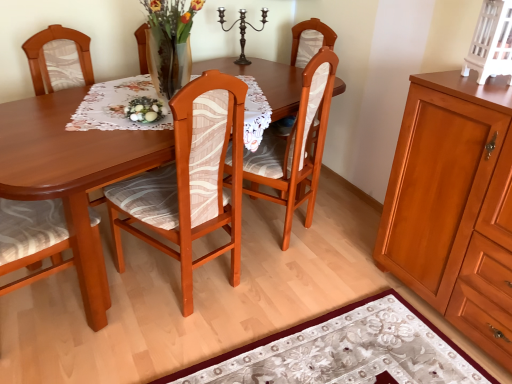
The width and height of the screenshot is (512, 384). I want to click on vacant space in front of wooden chair at center, the third chair positioned from the left, so click(x=289, y=278).